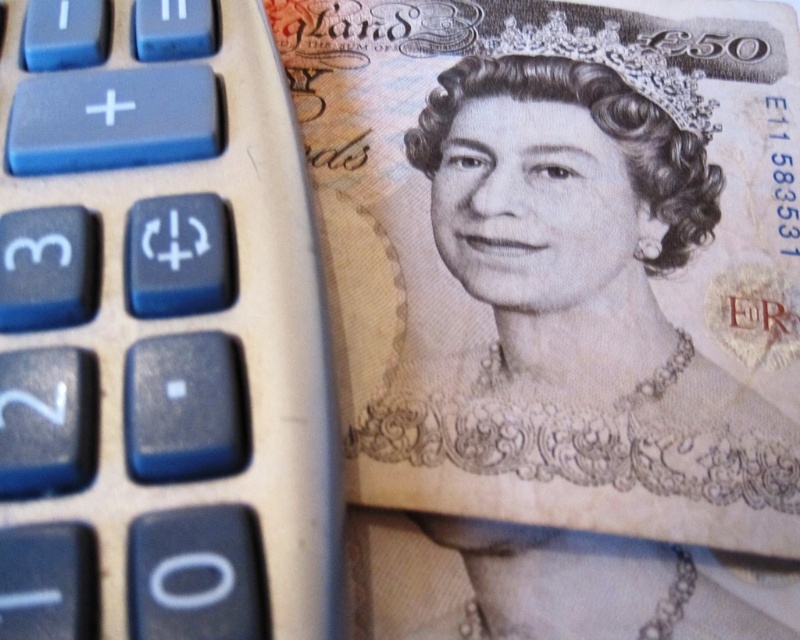
You are trying to place a sticky note on the calculator while looking at the blue plastic calculator at left and the smooth beige portrait at center. Which object is positioned higher in the image?

The blue plastic calculator at left is positioned higher than the smooth beige portrait at center.